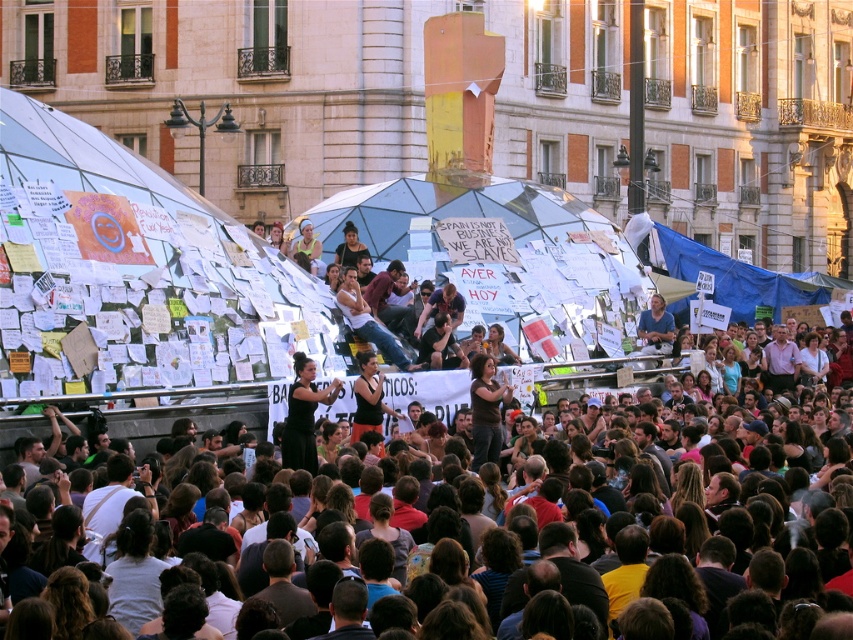
Is black dress at center further to camera compared to dark brown fabric at center?

No, it is in front of dark brown fabric at center.

Who is more distant from viewer, (300,451) or (483,449)?

Positioned behind is point (483,449).

What do you see at coordinates (303, 413) in the screenshot? I see `black dress at center` at bounding box center [303, 413].

The height and width of the screenshot is (640, 853). In order to click on black dress at center in this screenshot , I will do `click(303, 413)`.

The width and height of the screenshot is (853, 640). Describe the element at coordinates (303, 413) in the screenshot. I see `black dress at center` at that location.

Find the location of a particular element. black dress at center is located at coordinates (303, 413).

Which of these two, dark brown hair at center or blue cotton shirt at center, stands shorter?

With less height is blue cotton shirt at center.

Between point (775, 348) and point (648, 323), which one is positioned behind?

The point (775, 348) is behind.

This screenshot has width=853, height=640. I want to click on dark brown hair at center, so point(805,412).